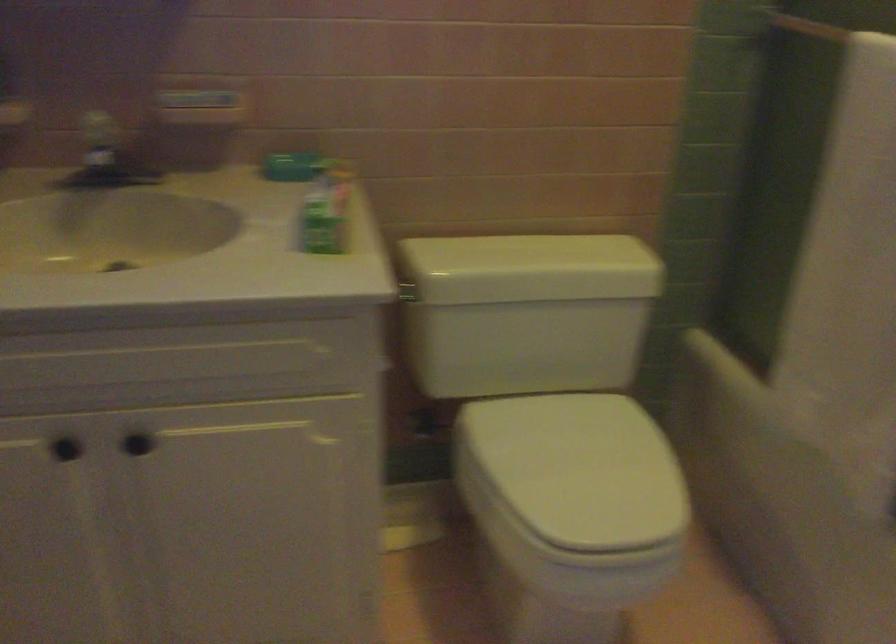
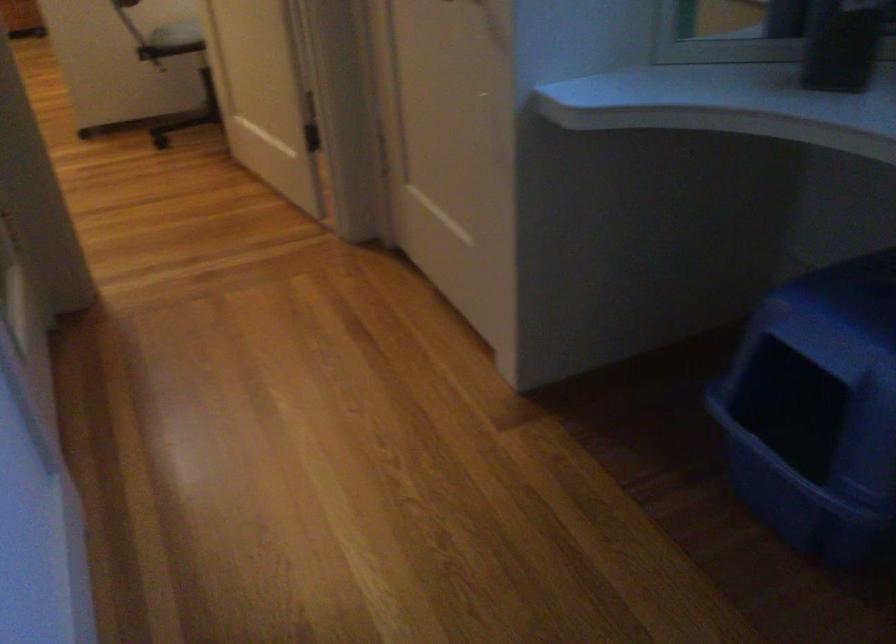
The images are taken continuously from a first-person perspective. In which direction is your viewpoint rotating?

The rotation direction of the camera is right-down.